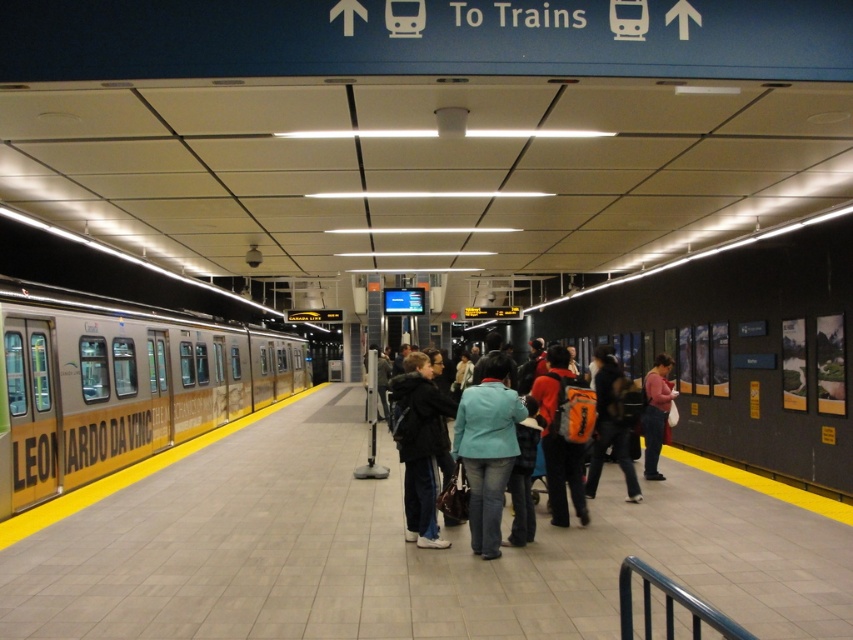
Locate an element on the screen. yellow metallic train at left is located at coordinates (122, 381).

Does yellow metallic train at left lie in front of denim jacket at center?

No, yellow metallic train at left is further to the viewer.

Which is in front, point (151, 445) or point (494, 515)?

Point (494, 515)

Where is `yellow metallic train at left`? Image resolution: width=853 pixels, height=640 pixels. yellow metallic train at left is located at coordinates (122, 381).

Where is `yellow metallic train at left`? yellow metallic train at left is located at coordinates (122, 381).

Who is lower down, yellow metallic train at left or pink fabric bag at center?

yellow metallic train at left is lower down.

Who is more distant from viewer, (33,376) or (659,444)?

Point (659,444)

Image resolution: width=853 pixels, height=640 pixels. I want to click on yellow metallic train at left, so click(122, 381).

Which of these two, denim jacket at center or pink fabric bag at center, stands shorter?

pink fabric bag at center

Is denim jacket at center to the right of pink fabric bag at center from the viewer's perspective?

In fact, denim jacket at center is to the left of pink fabric bag at center.

The image size is (853, 640). Find the location of `denim jacket at center`. denim jacket at center is located at coordinates (460, 445).